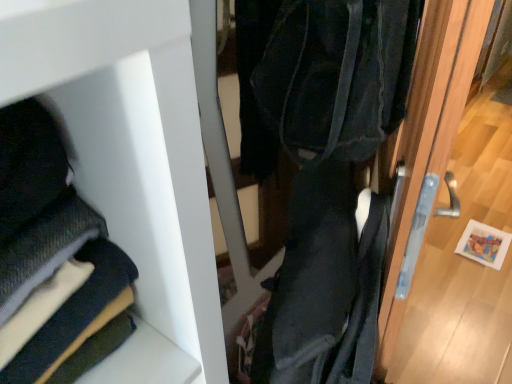
Question: Is wooden door handle at right bigger or smaller than dark blue fabric at lower left?

Choices:
 (A) big
 (B) small

Answer: (A)

Question: Considering the relative positions of wooden door handle at right and dark blue fabric at lower left in the image provided, is wooden door handle at right to the left or to the right of dark blue fabric at lower left?

Choices:
 (A) left
 (B) right

Answer: (B)

Question: In terms of height, does wooden door handle at right look taller or shorter compared to dark blue fabric at lower left?

Choices:
 (A) short
 (B) tall

Answer: (B)

Question: From the image's perspective, is dark blue fabric at lower left above or below wooden door handle at right?

Choices:
 (A) above
 (B) below

Answer: (A)

Question: Which is correct: dark blue fabric at lower left is inside wooden door handle at right, or outside of it?

Choices:
 (A) inside
 (B) outside

Answer: (B)

Question: In terms of height, does dark blue fabric at lower left look taller or shorter compared to wooden door handle at right?

Choices:
 (A) short
 (B) tall

Answer: (A)

Question: Based on their positions, is dark blue fabric at lower left located to the left or right of wooden door handle at right?

Choices:
 (A) right
 (B) left

Answer: (B)